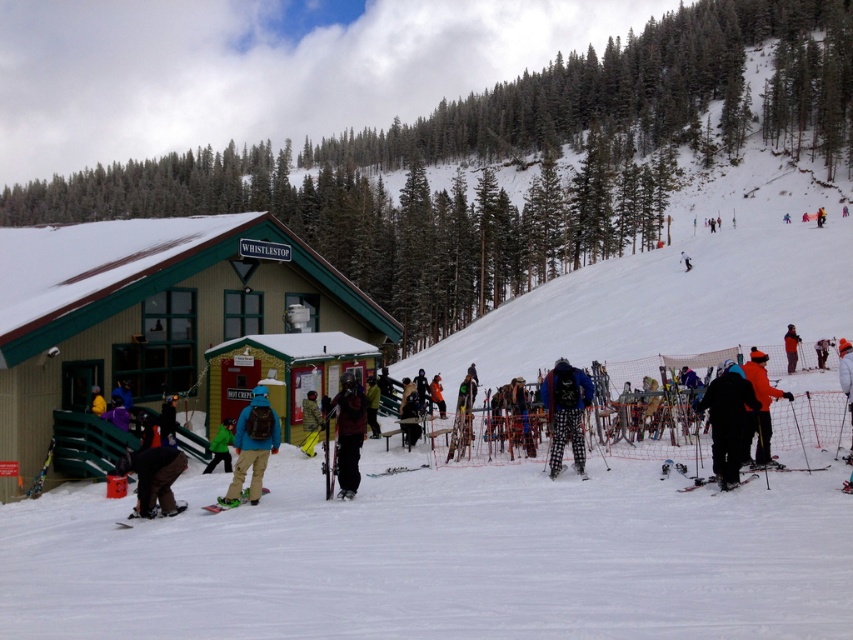
You are a photographer trying to capture the plaid pants at center and the white snow pants at center in the same frame. Which one is positioned higher in the image?

The plaid pants at center is above the white snow pants at center, so it is positioned higher in the image.

You are standing at the center of the ski resort scene. There is a matte black ski at lower right. Where is the matte black ski located in terms of coordinates?

The matte black ski at lower right is located at coordinates point (778, 467).

What are the coordinates of the matte blue snowboarder at center?

The coordinates of the matte blue snowboarder at center are 0.698 in the x direction and 0.297 in the y direction.